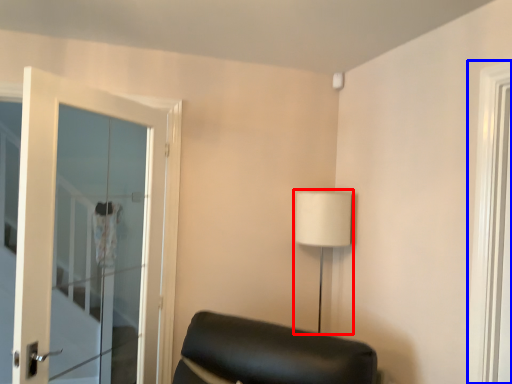
Question: Which object is further to the camera taking this photo, table lamp (highlighted by a red box) or window (highlighted by a blue box)?

Choices:
 (A) table lamp
 (B) window

Answer: (A)